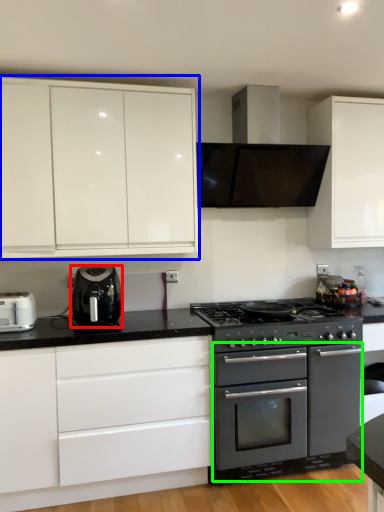
Question: Which is farther away from kitchen appliance (highlighted by a red box)? cabinetry (highlighted by a blue box) or oven (highlighted by a green box)?

Choices:
 (A) cabinetry
 (B) oven

Answer: (B)